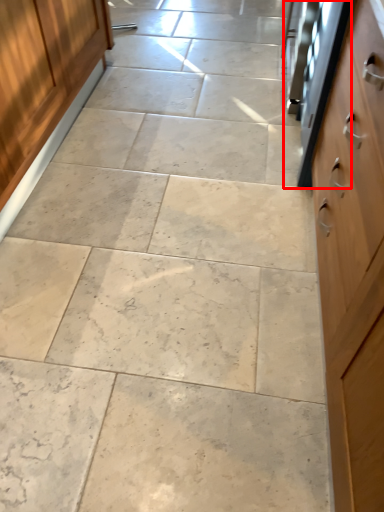
Question: From the image's perspective, considering the relative positions of oven (annotated by the red box) and cabinetry in the image provided, where is oven (annotated by the red box) located with respect to the staircase?

Choices:
 (A) above
 (B) below

Answer: (A)